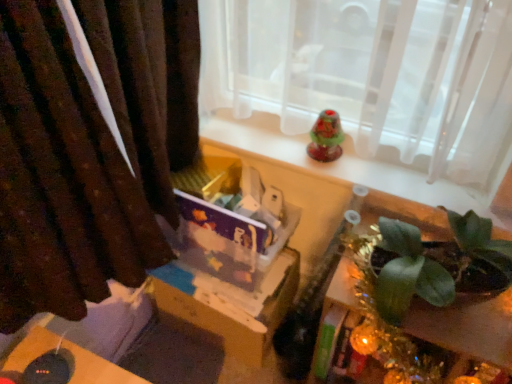
Question: From the image's perspective, is translucent glass bell at upper center located above or below brown velvet curtain at left?

Choices:
 (A) below
 (B) above

Answer: (B)

Question: Considering the positions of translucent glass bell at upper center and brown velvet curtain at left in the image, is translucent glass bell at upper center bigger or smaller than brown velvet curtain at left?

Choices:
 (A) big
 (B) small

Answer: (B)

Question: Estimate the real-world distances between objects in this image. Which object is farther from the green leafy plant at lower right?

Choices:
 (A) cardboard box at center
 (B) translucent glass bell at upper center
 (C) brown velvet curtain at left

Answer: (C)

Question: Estimate the real-world distances between objects in this image. Which object is farther from the green leafy plant at lower right?

Choices:
 (A) brown velvet curtain at left
 (B) translucent glass bell at upper center
 (C) cardboard box at center

Answer: (A)